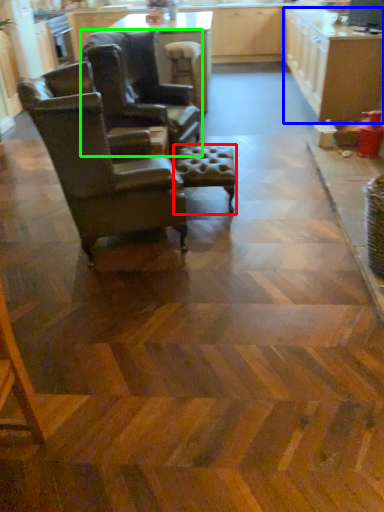
Question: Considering the real-world distances, which object is farthest from bar stool (highlighted by a red box)? cabinetry (highlighted by a blue box) or chair (highlighted by a green box)?

Choices:
 (A) cabinetry
 (B) chair

Answer: (A)